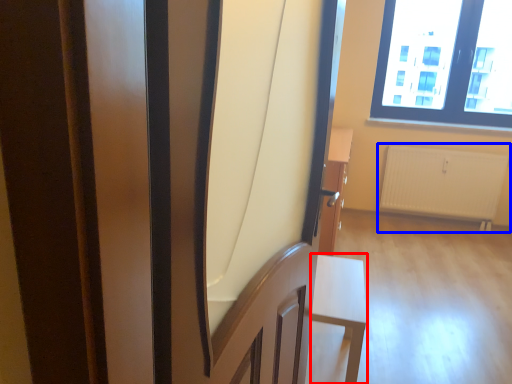
Question: Which point is further to the camera, furniture (highlighted by a red box) or radiator (highlighted by a blue box)?

Choices:
 (A) furniture
 (B) radiator

Answer: (B)